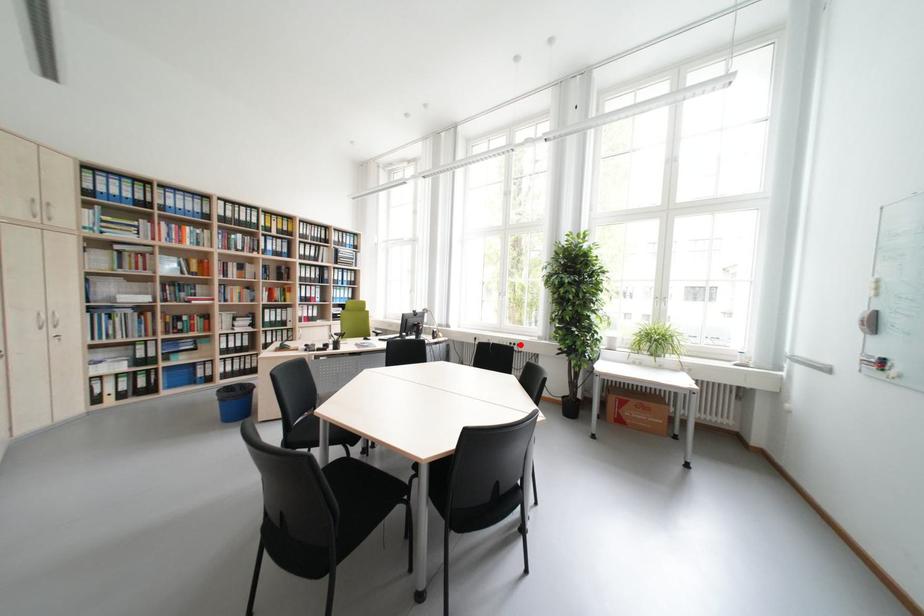
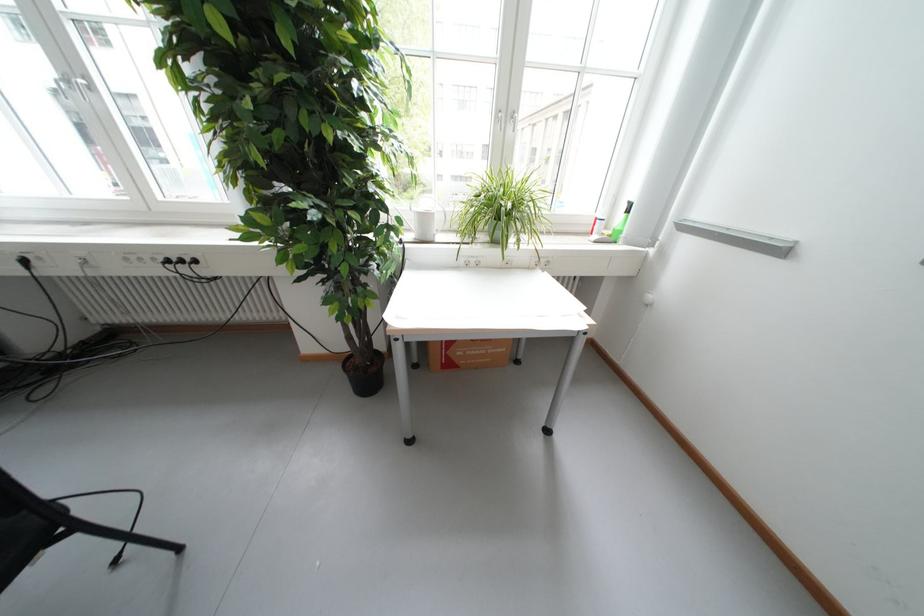
In the second image, find the point that corresponds to the highlighted location in the first image.

(177, 262)